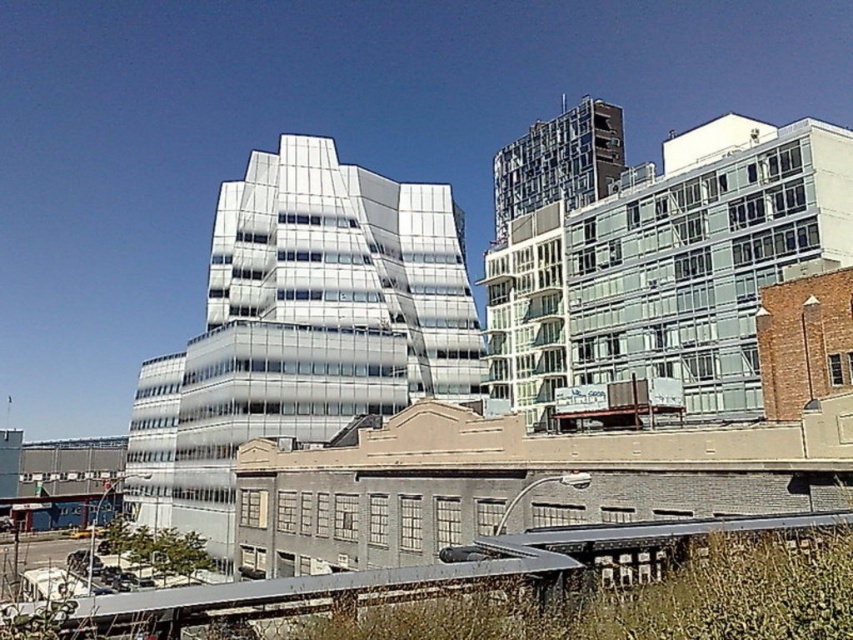
Between reflective glass building at center and metallic gray train track at lower center, which one is positioned lower?

Positioned lower is metallic gray train track at lower center.

Is point (410, 208) behind point (244, 609)?

That is True.

Identify the location of reflective glass building at center. (302, 326).